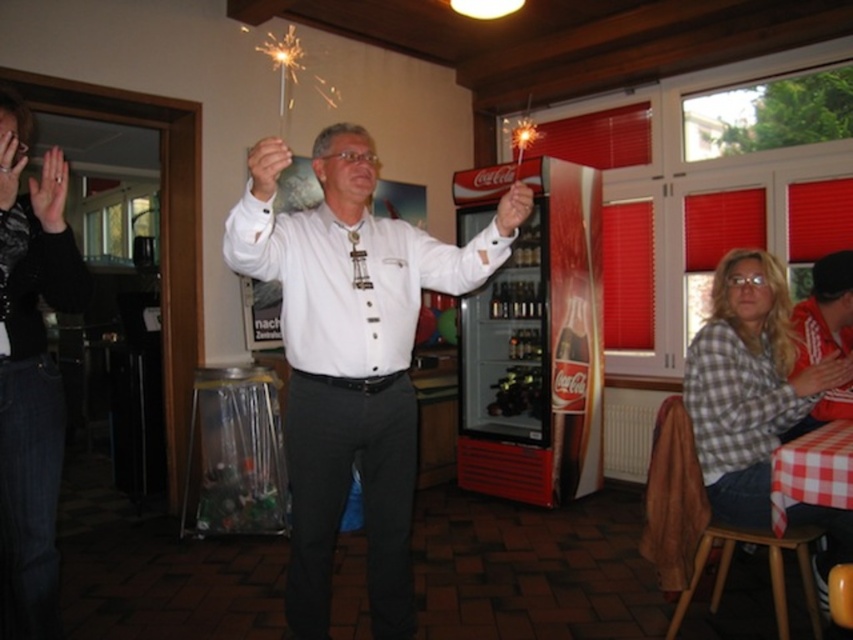
Question: Does white matte shirt at center have a smaller size compared to checkered fabric shirt at lower right?

Choices:
 (A) yes
 (B) no

Answer: (B)

Question: From the image, what is the correct spatial relationship of white matte shirt at center in relation to checkered fabric shirt at lower right?

Choices:
 (A) left
 (B) right

Answer: (A)

Question: Estimate the real-world distances between objects in this image. Which object is closer to the checkered fabric shirt at lower right?

Choices:
 (A) white matte shirt at center
 (B) black textured sweater at left

Answer: (A)

Question: Which of the following is the closest to the observer?

Choices:
 (A) checkered fabric shirt at lower right
 (B) black textured sweater at left

Answer: (B)

Question: Can you confirm if white matte shirt at center is positioned to the left of checkered fabric shirt at lower right?

Choices:
 (A) no
 (B) yes

Answer: (B)

Question: Among these objects, which one is nearest to the camera?

Choices:
 (A) black textured sweater at left
 (B) white matte shirt at center

Answer: (B)